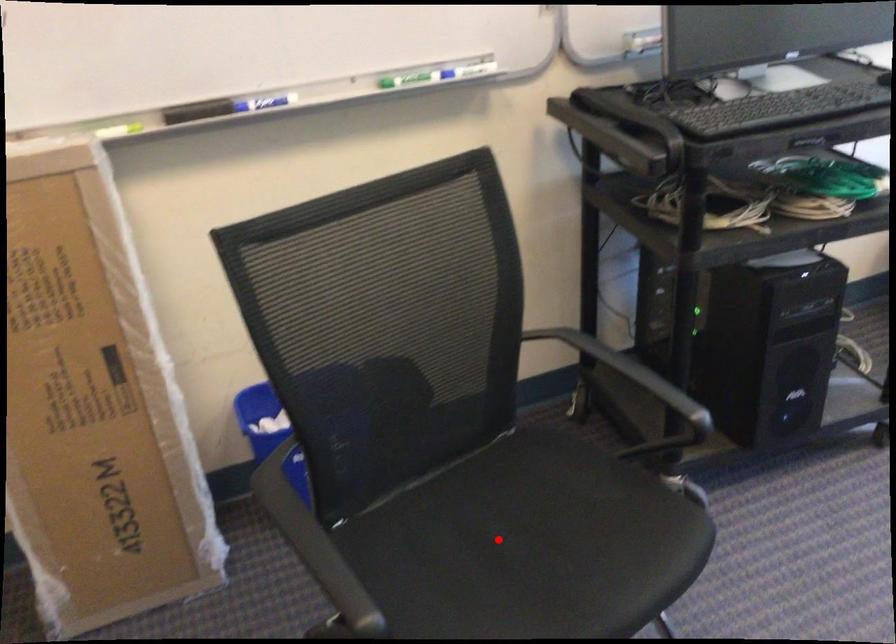
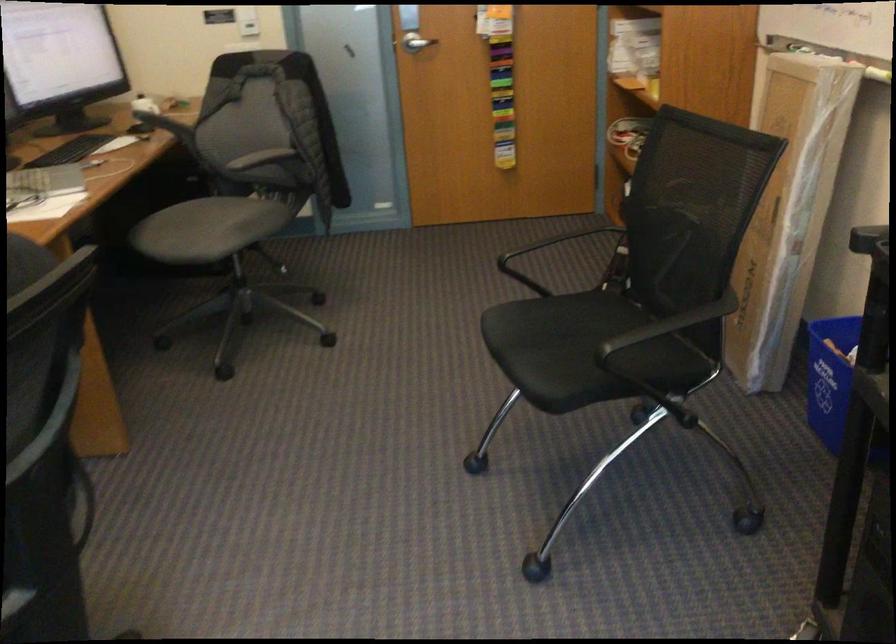
Question: A red point is marked in image1. In image2, is the corresponding 3D point closer to the camera or farther? Reply with the corresponding letter.

Choices:
 (A) The corresponding 3D point is closer.
 (B) The corresponding 3D point is farther.

Answer: (B)